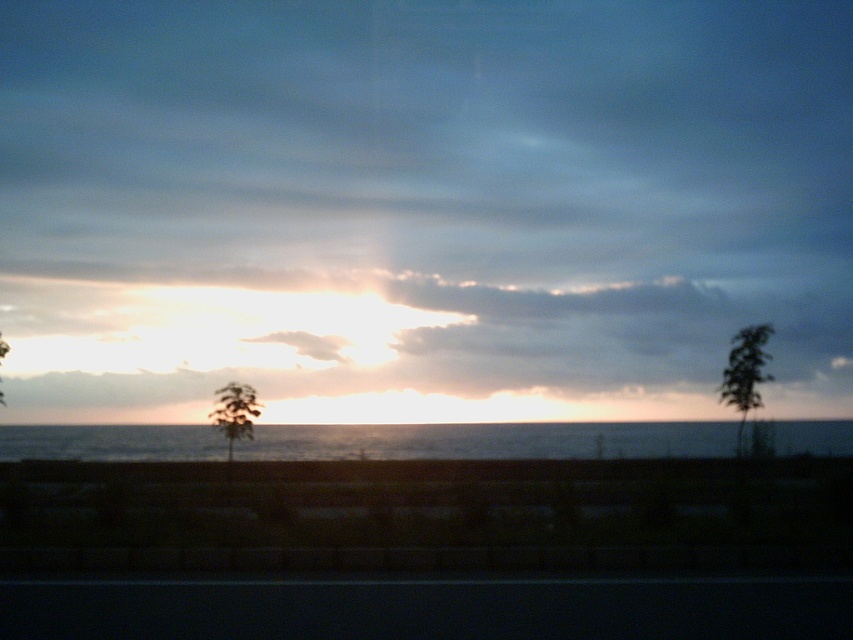
Does point (419, 324) come behind point (77, 435)?

That is True.

Between golden translucent clouds at center and blue water at center, which one is positioned lower?

blue water at center

At what (x,y) coordinates should I click in order to perform the action: click on golden translucent clouds at center. Please return your answer as a coordinate pair (x, y). The width and height of the screenshot is (853, 640). Looking at the image, I should click on (408, 349).

Is golden translucent clouds at center thinner than green leafy tree at right?

Incorrect, golden translucent clouds at center's width is not less than green leafy tree at right's.

Does golden translucent clouds at center appear under green leafy tree at right?

Actually, golden translucent clouds at center is above green leafy tree at right.

You are a GUI agent. You are given a task and a screenshot of the screen. Output one action in this format:
    pyautogui.click(x=<x>, y=<y>)
    Task: Click on the golden translucent clouds at center
    The height and width of the screenshot is (640, 853).
    Given the screenshot: What is the action you would take?
    pyautogui.click(x=408, y=349)

Image resolution: width=853 pixels, height=640 pixels. Identify the location of golden translucent clouds at center. (408, 349).

Does point (743, 378) lie behind point (230, 429)?

Yes.

Where is `green leafy tree at right`? green leafy tree at right is located at coordinates (746, 372).